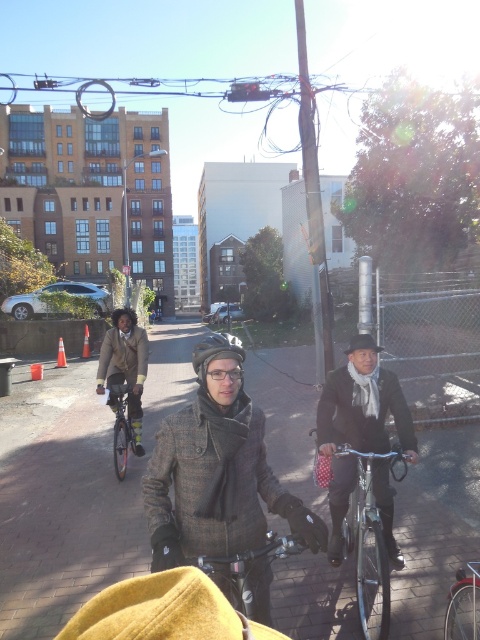
You are a delivery person who needs to quickly pick up a bicycle to deliver a package. You see the silver metallic bicycle at center and the shiny black bicycle at center. Which bicycle is closer to you?

The silver metallic bicycle at center and shiny black bicycle at center are 1.08 meters apart from each other, so you need to determine which one is closer based on their positions. However, the description does not specify which is closer, only the distance between them. Therefore, you cannot determine which is closer without additional information.

You are a photographer standing in the scene and want to take a photo that includes both the point at coordinates point (116,413) and point (204,339). Since you want both points to be in focus, you need to know which point is closer to the camera. Which point is closer?

Point (116,413) is closer to the camera than point (204,339), so you should focus on that point to ensure both are in focus.

You are a delivery person who needs to secure a black matte bicycle helmet at center onto a black matte bicycle at center. Based on the scene, can the helmet fit on the bicycle without any adjustments?

The black matte bicycle at center is taller than the black matte bicycle helmet at center, so the helmet can fit on the bicycle without any adjustments.